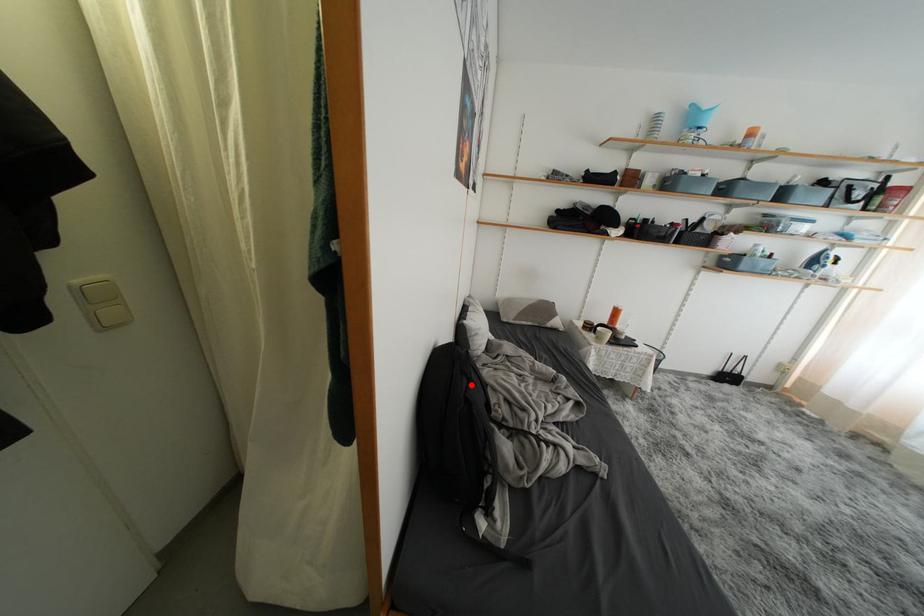
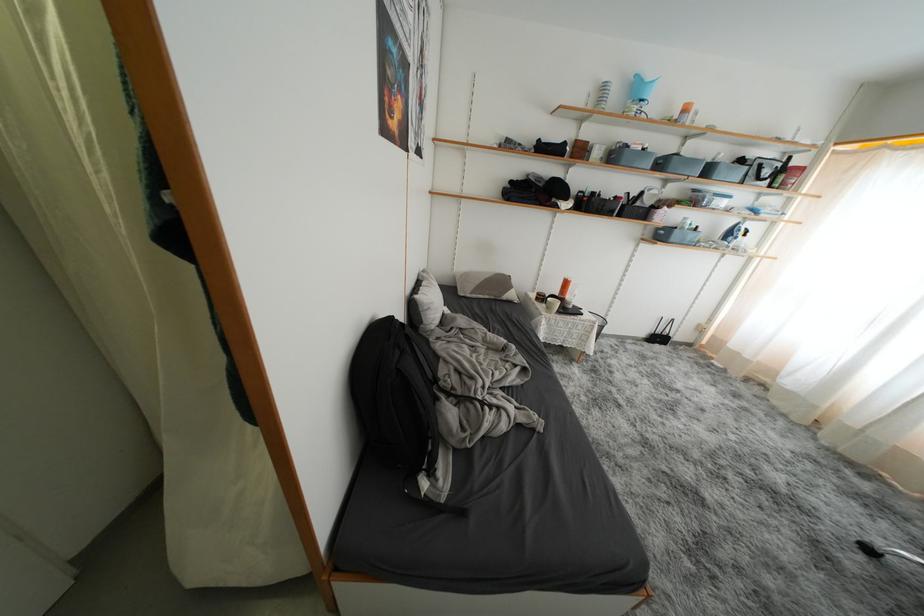
Question: I am providing you with two images of the same scene from different viewpoints. Given a red point in image1, look at the same physical point in image2. Is it:

Choices:
 (A) Closer to the viewpoint
 (B) Farther from the viewpoint

Answer: (B)